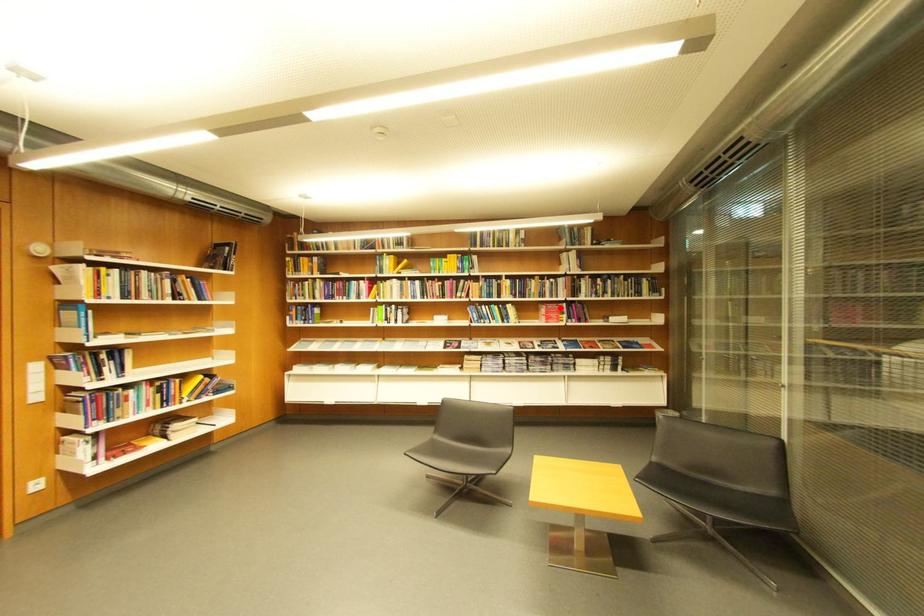
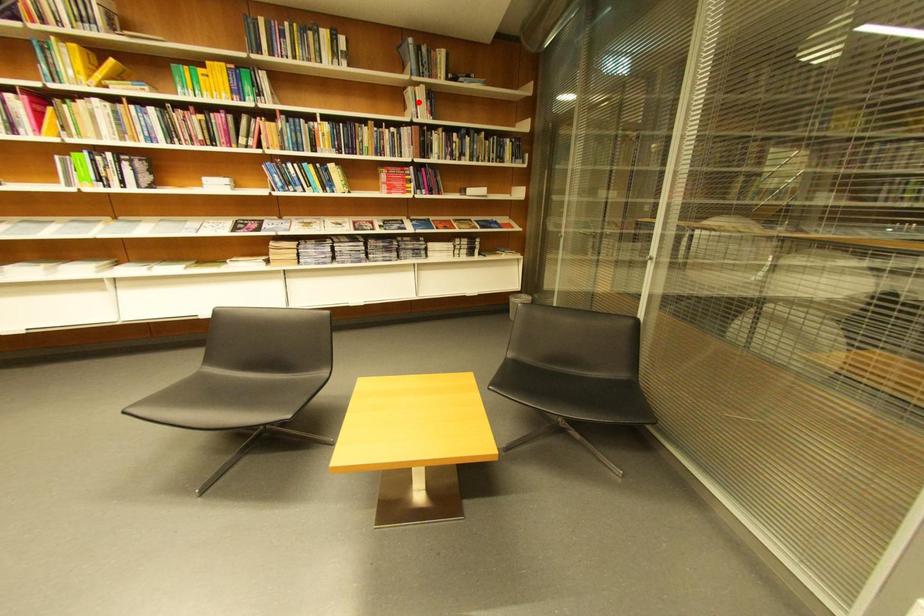
I am providing you with two images of the same scene from different viewpoints. A red point is marked on the first image and another point is marked on the second image. Do the highlighted points in image1 and image2 indicate the same real-world spot?

No